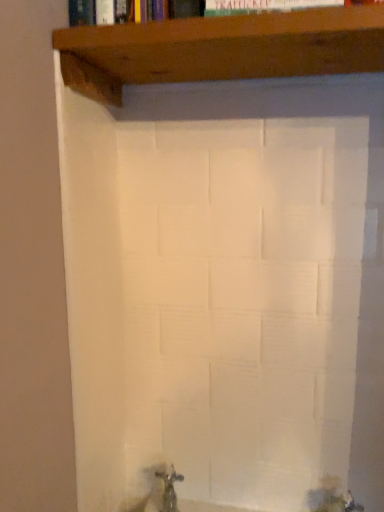
Question: In terms of size, does brown wood shelf at upper center appear bigger or smaller than metallic silver tap at lower center?

Choices:
 (A) big
 (B) small

Answer: (A)

Question: Looking at their shapes, would you say brown wood shelf at upper center is wider or thinner than metallic silver tap at lower center?

Choices:
 (A) wide
 (B) thin

Answer: (A)

Question: From their relative heights in the image, would you say brown wood shelf at upper center is taller or shorter than metallic silver tap at lower center?

Choices:
 (A) tall
 (B) short

Answer: (B)

Question: In terms of size, does metallic silver tap at lower center appear bigger or smaller than brown wood shelf at upper center?

Choices:
 (A) small
 (B) big

Answer: (A)

Question: In the image, is metallic silver tap at lower center on the left side or the right side of brown wood shelf at upper center?

Choices:
 (A) left
 (B) right

Answer: (A)

Question: Looking at their shapes, would you say metallic silver tap at lower center is wider or thinner than brown wood shelf at upper center?

Choices:
 (A) wide
 (B) thin

Answer: (B)

Question: From a real-world perspective, is metallic silver tap at lower center physically located above or below brown wood shelf at upper center?

Choices:
 (A) above
 (B) below

Answer: (B)